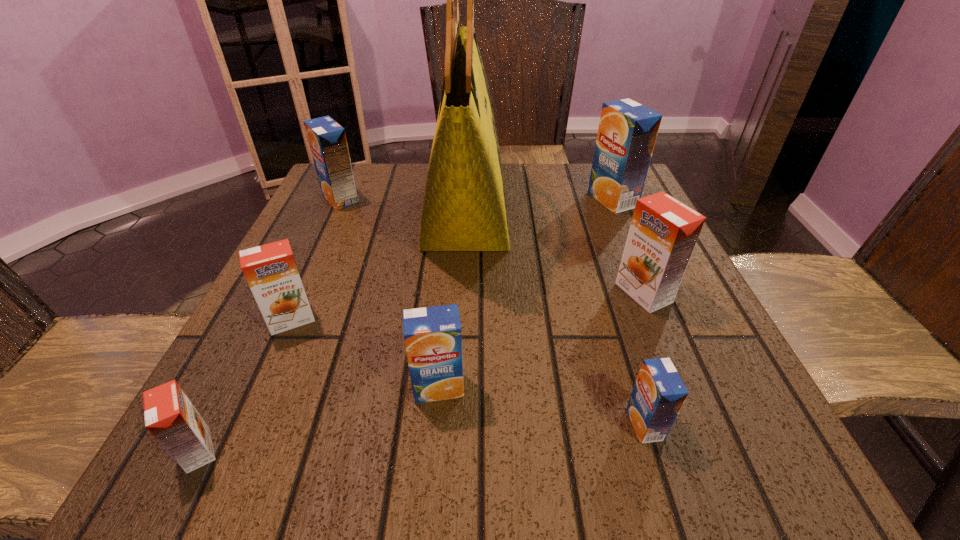
In order to click on unoccupied area between the smallest orange orange juice and the tallest object in this screenshot , I will do `click(332, 333)`.

Find the location of `blank region between the nearest blue orange_juice and the rightmost blue orange_juice`. blank region between the nearest blue orange_juice and the rightmost blue orange_juice is located at coordinates (629, 312).

The image size is (960, 540). I want to click on free area in between the sixth object from left to right and the rightmost blue orange_juice, so tap(629, 312).

This screenshot has height=540, width=960. In order to click on free space between the fifth farthest orange juice and the tallest object in this screenshot , I will do `click(452, 301)`.

The height and width of the screenshot is (540, 960). I want to click on vacant space that is in between the smallest orange orange juice and the second biggest orange orange juice, so click(x=245, y=385).

The width and height of the screenshot is (960, 540). What are the coordinates of `object that is the sixth nearest to the third farthest blue orange_juice` in the screenshot? It's located at (327, 139).

Locate which object ranks fifth in proximity to the fourth orange juice from left to right. Please provide its 2D coordinates. Your answer should be formatted as a tuple, i.e. [(x, y)], where the tuple contains the x and y coordinates of a point satisfying the conditions above.

[(663, 233)]

Identify the location of the third closest orange juice relative to the leftmost blue orange_juice. The height and width of the screenshot is (540, 960). (627, 132).

The height and width of the screenshot is (540, 960). I want to click on orange juice that is the sixth closest to the tallest orange juice, so click(170, 417).

Select which blue orange_juice appears as the closest to the rightmost blue orange_juice. Please provide its 2D coordinates. Your answer should be formatted as a tuple, i.e. [(x, y)], where the tuple contains the x and y coordinates of a point satisfying the conditions above.

[(659, 393)]